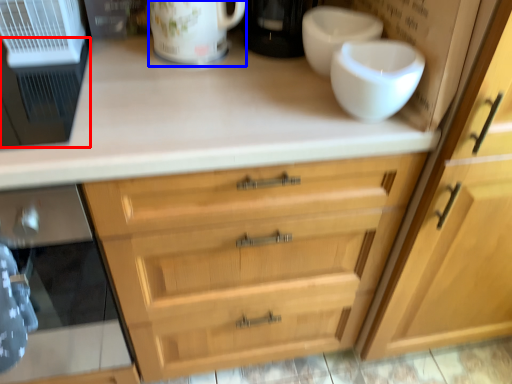
Question: Which object is further to the camera taking this photo, appliance (highlighted by a red box) or mug (highlighted by a blue box)?

Choices:
 (A) appliance
 (B) mug

Answer: (B)